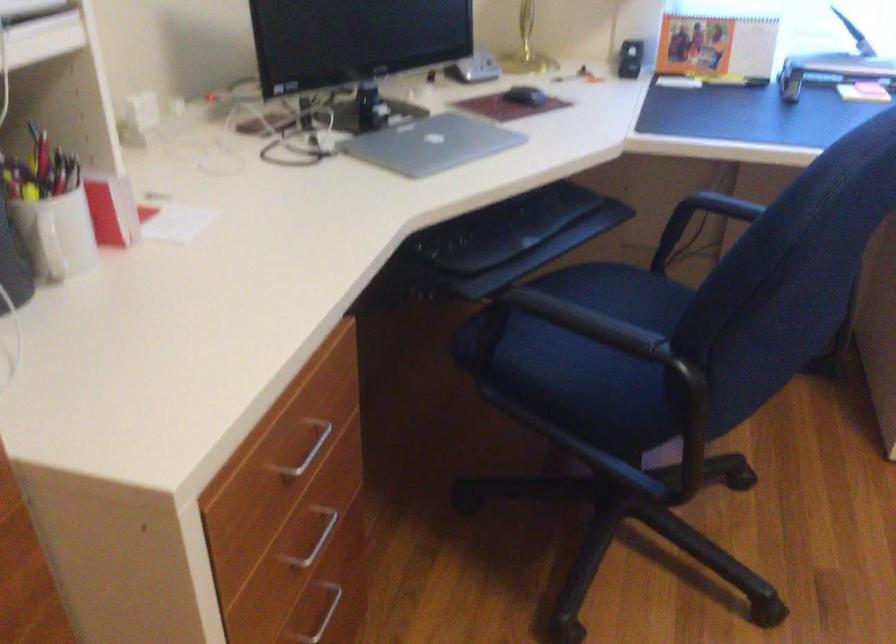
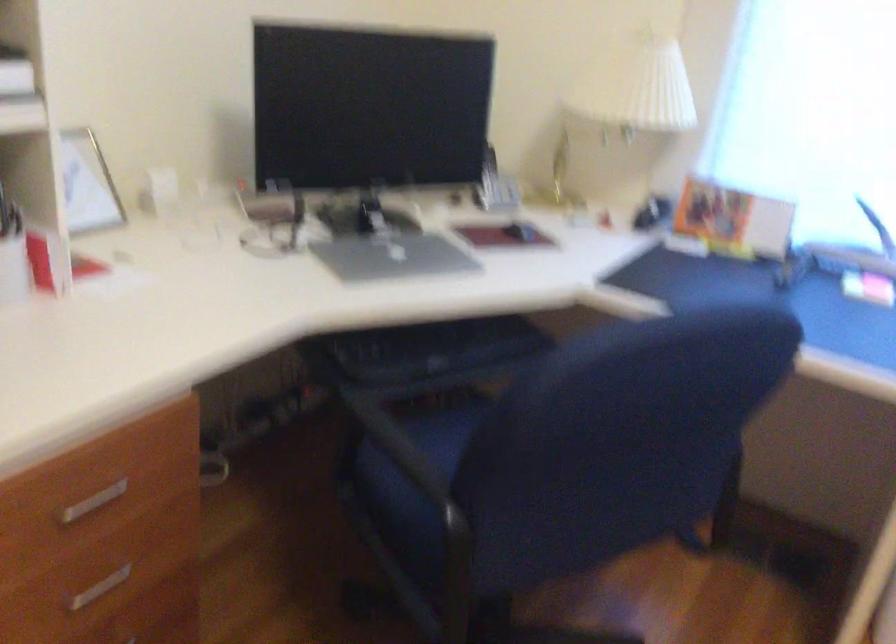
Question: The images are taken continuously from a first-person perspective. In which direction are you moving?

Choices:
 (A) Left
 (B) Right
 (C) Forward
 (D) Backward

Answer: (B)